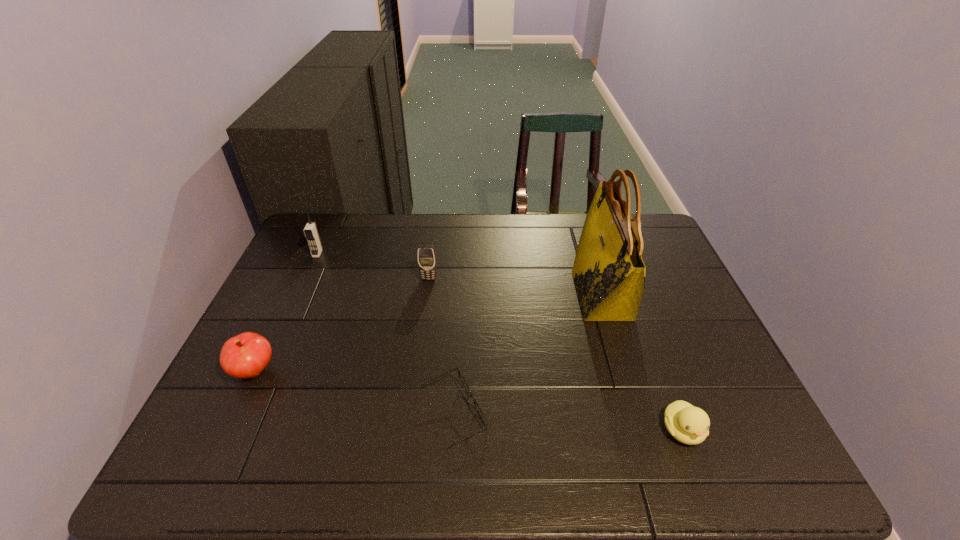
Find the location of a particular element. the tallest object is located at coordinates (609, 274).

Identify the location of the taller cellular telephone. (311, 233).

At what (x,y) coordinates should I click in order to perform the action: click on the left cellular telephone. Please return your answer as a coordinate pair (x, y). Looking at the image, I should click on (311, 233).

Where is `the right cellular telephone`? This screenshot has height=540, width=960. the right cellular telephone is located at coordinates (426, 256).

Locate an element on the screen. The height and width of the screenshot is (540, 960). the nearer cellular telephone is located at coordinates (426, 256).

I want to click on apple, so click(246, 355).

You are a GUI agent. You are given a task and a screenshot of the screen. Output one action in this format:
    pyautogui.click(x=<x>, y=<y>)
    Task: Click on the duckling
    The image size is (960, 540).
    Given the screenshot: What is the action you would take?
    pyautogui.click(x=690, y=425)

At what (x,y) coordinates should I click in order to perform the action: click on spectacles. Please return your answer as a coordinate pair (x, y). Looking at the image, I should click on (462, 379).

The width and height of the screenshot is (960, 540). Find the location of `vacant region located 0.270m on the front-facing side of the tote bag`. vacant region located 0.270m on the front-facing side of the tote bag is located at coordinates (482, 295).

The width and height of the screenshot is (960, 540). I want to click on free space located on the front-facing side of the tote bag, so click(x=468, y=295).